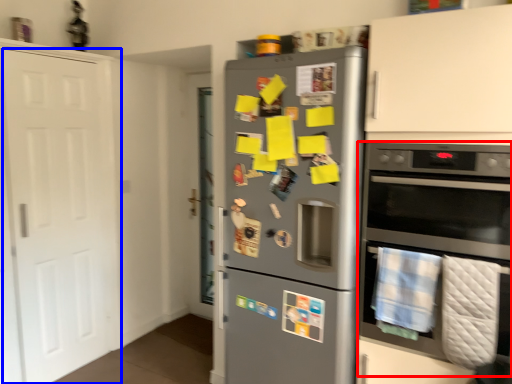
Question: Which of the following is the farthest to the observer, oven (highlighted by a red box) or door (highlighted by a blue box)?

Choices:
 (A) oven
 (B) door

Answer: (B)